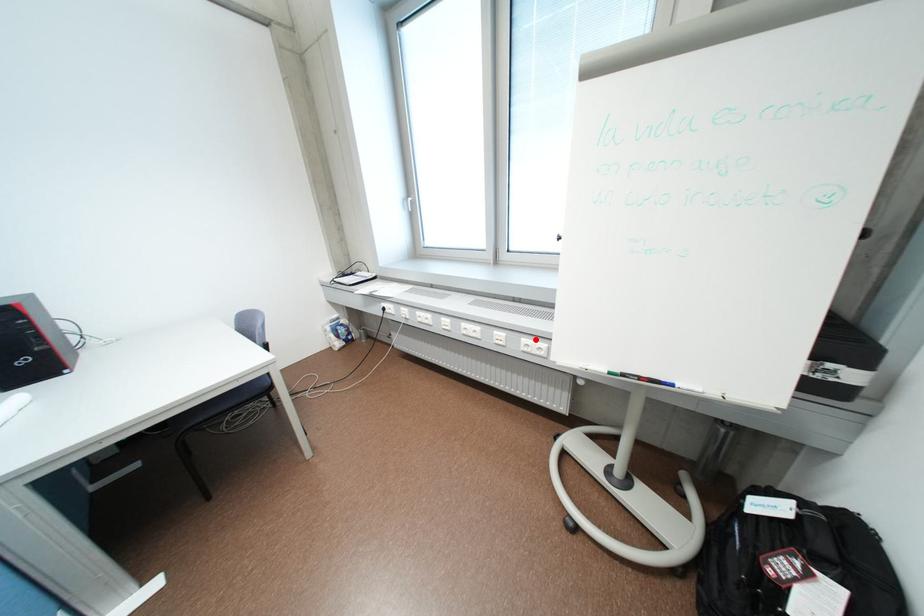
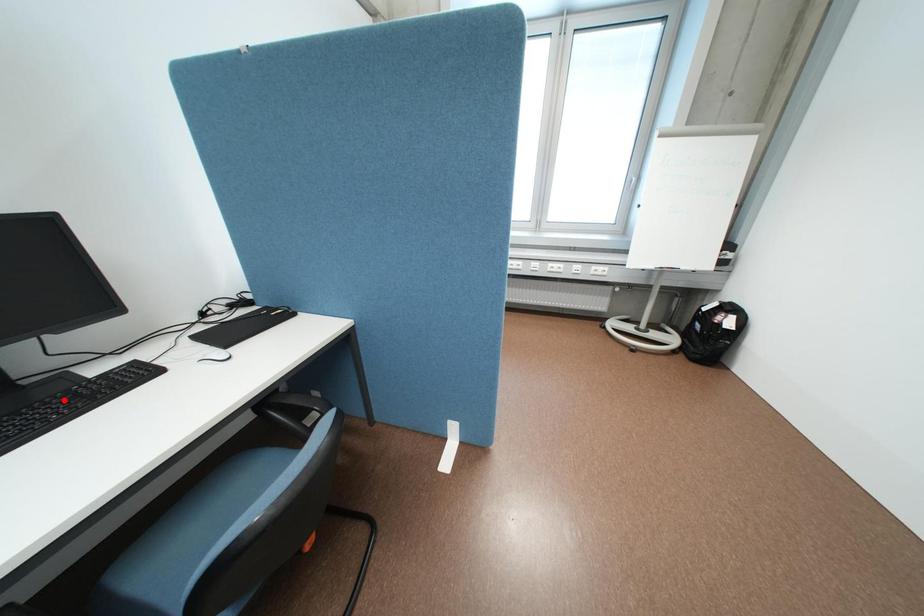
Looking at this image, I am providing you with two images of the same scene from different viewpoints. A red point is marked on the first image and another point is marked on the second image. Is the marked point in image1 the same physical position as the marked point in image2?

No